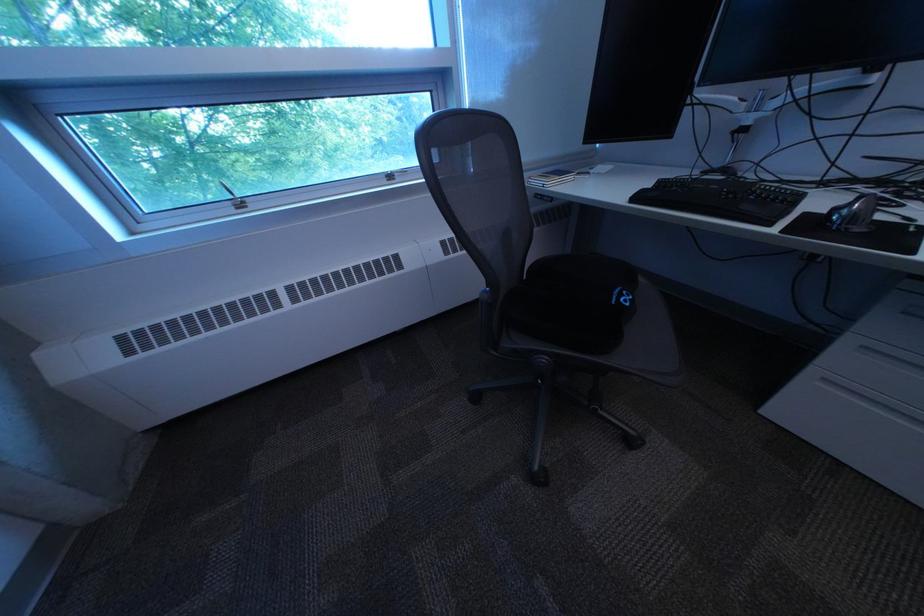
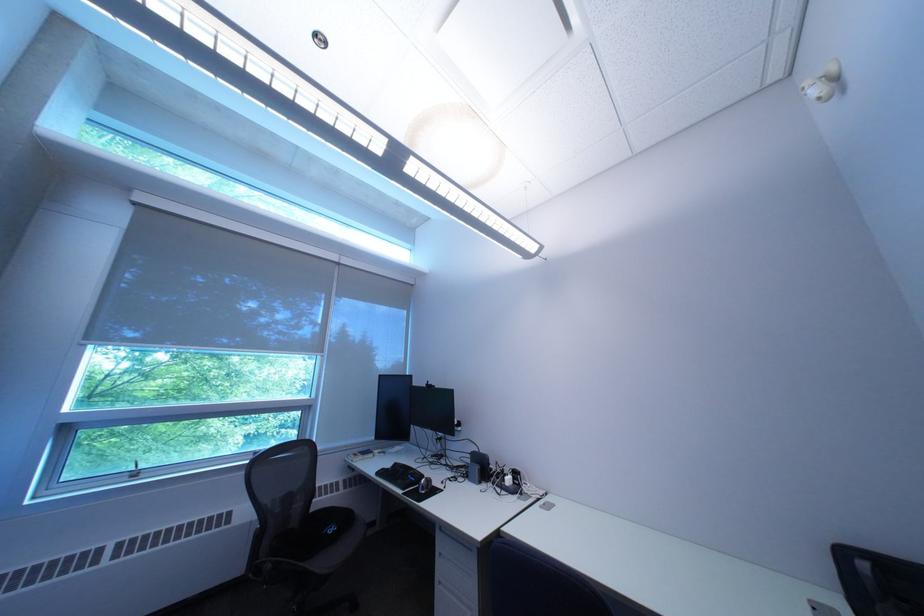
Find the pixel in the second image that matches pixel 796 235 in the first image.

(418, 495)